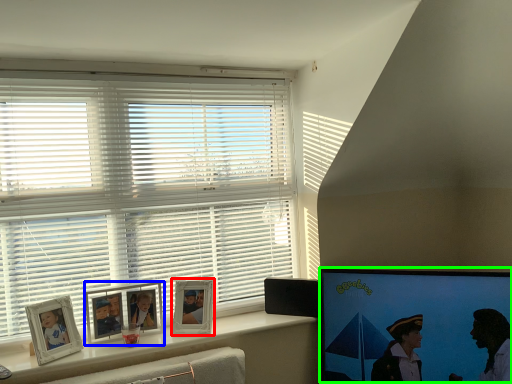
Question: Which is nearer to the picture frame (highlighted by a red box)? picture frame (highlighted by a blue box) or computer monitor (highlighted by a green box).

Choices:
 (A) picture frame
 (B) computer monitor

Answer: (A)